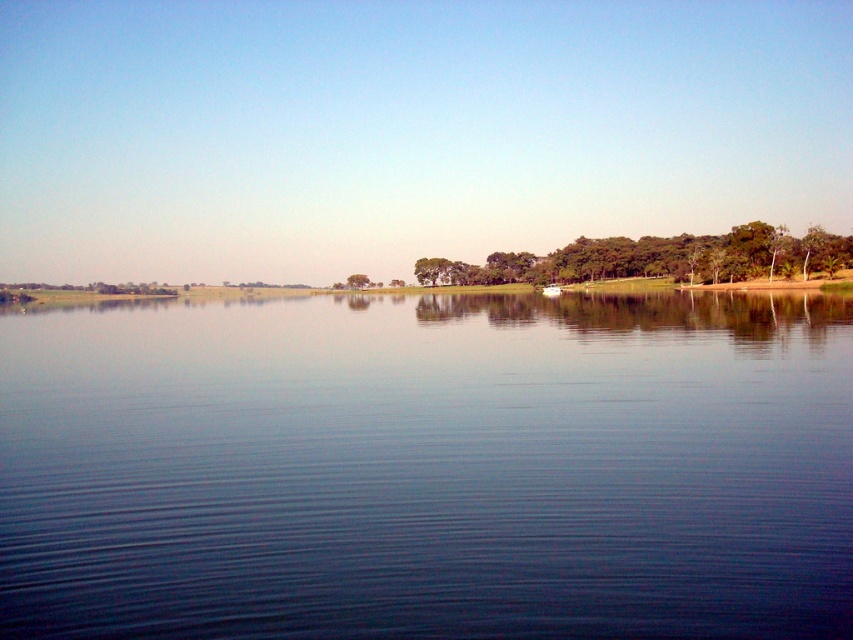
Question: Is blue smooth water at center in front of green leafy tree at center?

Choices:
 (A) no
 (B) yes

Answer: (B)

Question: Is blue smooth water at center smaller than green leafy trees at center?

Choices:
 (A) no
 (B) yes

Answer: (B)

Question: Which object is closer to the camera taking this photo?

Choices:
 (A) blue smooth water at center
 (B) green leafy trees at center

Answer: (A)

Question: Can you confirm if green leafy trees at center is positioned to the right of green leafy tree at center?

Choices:
 (A) no
 (B) yes

Answer: (B)

Question: Which of the following is the closest to the observer?

Choices:
 (A) blue smooth water at center
 (B) green leafy tree at center
 (C) green leafy trees at center

Answer: (A)

Question: Among these points, which one is nearest to the camera?

Choices:
 (A) (357, 273)
 (B) (477, 280)
 (C) (79, 596)

Answer: (C)